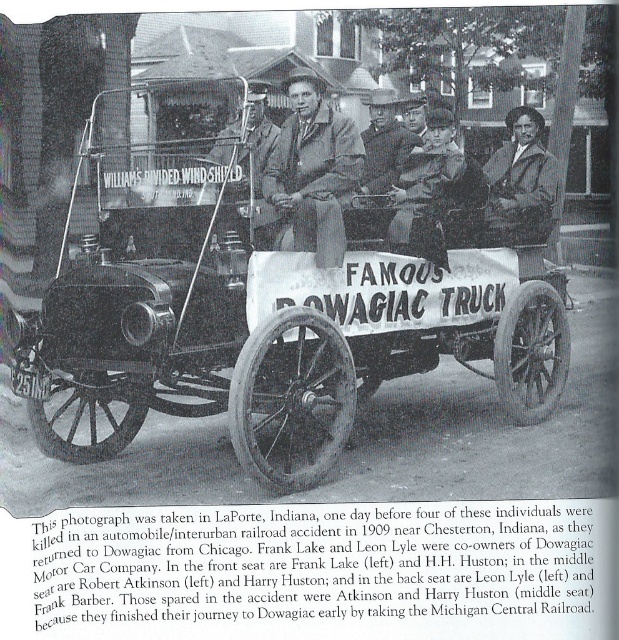
Question: Can you confirm if dark brown fur coat at center is positioned to the left of smooth leather jacket at center?

Choices:
 (A) yes
 (B) no

Answer: (B)

Question: Which object is positioned closest to the matte brown coat at center?

Choices:
 (A) metallic polished wagon at center
 (B) dark brown fur coat at center

Answer: (B)

Question: Among these objects, which one is farthest from the camera?

Choices:
 (A) matte brown coat at center
 (B) metallic polished wagon at center
 (C) smooth leather jacket at center

Answer: (C)

Question: Which point is farther to the camera?

Choices:
 (A) (431, 248)
 (B) (335, 196)

Answer: (A)

Question: Does metallic polished wagon at center have a greater width compared to smooth leather jacket at center?

Choices:
 (A) no
 (B) yes

Answer: (B)

Question: Is metallic polished wagon at center positioned in front of matte brown coat at center?

Choices:
 (A) no
 (B) yes

Answer: (B)